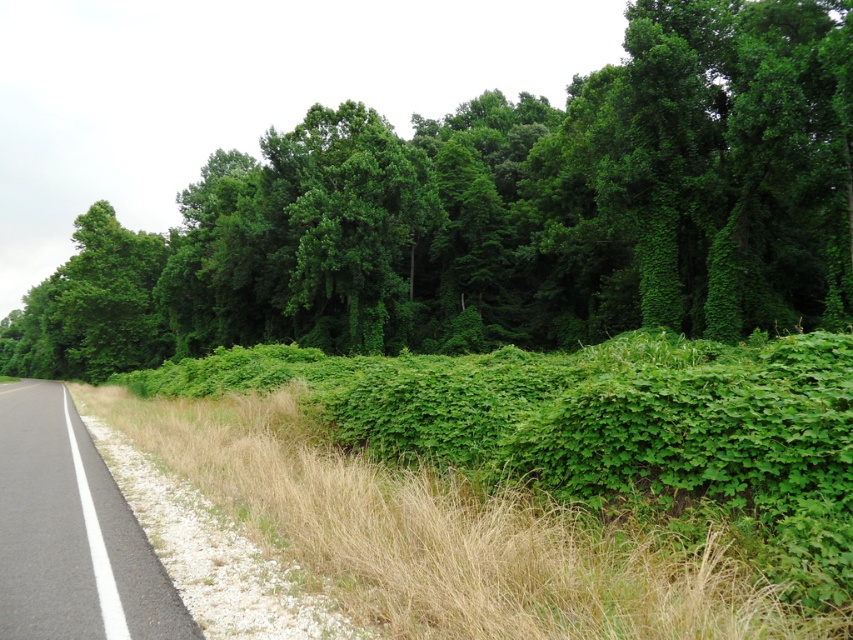
Who is more distant from viewer, (398, 170) or (151, 550)?

The point (398, 170) is more distant.

Who is taller, green leafy bush at center or black asphalt road at left?

With more height is green leafy bush at center.

Identify the location of green leafy bush at center. Image resolution: width=853 pixels, height=640 pixels. click(502, 214).

Identify the location of green leafy bush at center. (502, 214).

Who is more forward, (x=289, y=419) or (x=76, y=552)?

Point (x=76, y=552) is in front.

Who is more distant from viewer, [370,572] or [56,458]?

The point [56,458] is more distant.

Locate an element on the screen. This screenshot has width=853, height=640. green leafy grass at center is located at coordinates (450, 536).

Does point (784, 144) come farther from viewer compared to point (386, 499)?

Yes, point (784, 144) is farther from viewer.

Looking at this image, does green leafy bush at center have a larger size compared to green leafy grass at center?

Yes.

Which is behind, point (444, 227) or point (659, 602)?

The point (444, 227) is behind.

In order to click on green leafy bush at center in this screenshot , I will do 502,214.